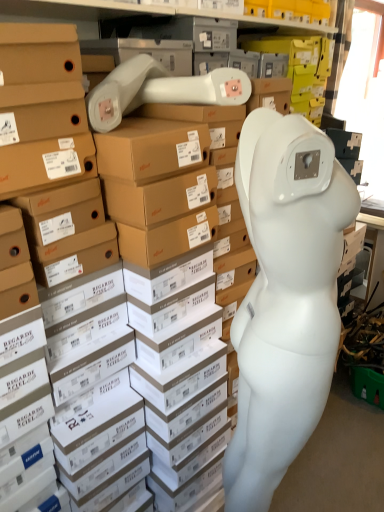
Identify the location of white matte mannequin head at center. The height and width of the screenshot is (512, 384). (292, 193).

The image size is (384, 512). What do you see at coordinates (292, 193) in the screenshot?
I see `white matte mannequin head at center` at bounding box center [292, 193].

What are the coordinates of `white matte mannequin at right` in the screenshot? It's located at (285, 297).

The height and width of the screenshot is (512, 384). Describe the element at coordinates (285, 297) in the screenshot. I see `white matte mannequin at right` at that location.

Image resolution: width=384 pixels, height=512 pixels. In order to click on white matte mannequin head at center in this screenshot , I will do `click(292, 193)`.

Is white matte mannequin at right at the left side of white matte mannequin head at center?

Yes.

Which object is further away from the camera taking this photo, white matte mannequin at right or white matte mannequin head at center?

white matte mannequin head at center is more distant.

Which is in front, point (289, 234) or point (266, 213)?

The point (266, 213) is in front.

From the image's perspective, is white matte mannequin at right above white matte mannequin head at center?

Incorrect, from the image's perspective, white matte mannequin at right is lower than white matte mannequin head at center.

From a real-world perspective, is white matte mannequin at right physically above white matte mannequin head at center?

Actually, white matte mannequin at right is physically below white matte mannequin head at center in the real world.

Is white matte mannequin at right wider than white matte mannequin head at center?

Incorrect, the width of white matte mannequin at right does not surpass that of white matte mannequin head at center.

Is white matte mannequin at right taller or shorter than white matte mannequin head at center?

In the image, white matte mannequin at right appears to be taller than white matte mannequin head at center.

Who is smaller, white matte mannequin at right or white matte mannequin head at center?

white matte mannequin head at center.

Is white matte mannequin at right outside of white matte mannequin head at center?

Indeed, white matte mannequin at right is completely outside white matte mannequin head at center.

Is white matte mannequin at right with white matte mannequin head at center?

No, white matte mannequin at right is not beside white matte mannequin head at center.

Is white matte mannequin at right facing towards white matte mannequin head at center?

No.

Where is `worker in front of the white matte mannequin head at center`? worker in front of the white matte mannequin head at center is located at coordinates click(285, 297).

Does white matte mannequin head at center appear on the left side of white matte mannequin at right?

No, white matte mannequin head at center is not to the left of white matte mannequin at right.

Is white matte mannequin head at center closer to camera compared to white matte mannequin at right?

No, white matte mannequin head at center is behind white matte mannequin at right.

Is point (279, 117) farther from viewer compared to point (264, 328)?

That is False.

From the image's perspective, which one is positioned lower, white matte mannequin head at center or white matte mannequin at right?

From the image's view, white matte mannequin at right is below.

From the picture: From a real-world perspective, is white matte mannequin head at center positioned over white matte mannequin at right based on gravity?

Yes, from a real-world perspective, white matte mannequin head at center is above white matte mannequin at right.

Does white matte mannequin head at center have a greater width compared to white matte mannequin at right?

Indeed, white matte mannequin head at center has a greater width compared to white matte mannequin at right.

Considering the relative sizes of white matte mannequin head at center and white matte mannequin at right in the image provided, is white matte mannequin head at center shorter than white matte mannequin at right?

Yes.

Between white matte mannequin head at center and white matte mannequin at right, which one has larger size?

Bigger between the two is white matte mannequin at right.

Would you say white matte mannequin head at center contains white matte mannequin at right?

No.

Would you say white matte mannequin head at center is a long distance from white matte mannequin at right?

No.

Looking at this image, is white matte mannequin head at center positioned with its back to white matte mannequin at right?

No.

You are a GUI agent. You are given a task and a screenshot of the screen. Output one action in this format:
    pyautogui.click(x=<x>, y=<y>)
    Task: Click on the head that appears behind the white matte mannequin at right
    The height and width of the screenshot is (512, 384).
    Given the screenshot: What is the action you would take?
    pyautogui.click(x=292, y=193)

You are a GUI agent. You are given a task and a screenshot of the screen. Output one action in this format:
    pyautogui.click(x=<x>, y=<y>)
    Task: Click on the worker lying in front of the white matte mannequin head at center
    Image resolution: width=384 pixels, height=512 pixels.
    Given the screenshot: What is the action you would take?
    pyautogui.click(x=285, y=297)

This screenshot has width=384, height=512. I want to click on worker that appears below the white matte mannequin head at center (from the image's perspective), so click(x=285, y=297).